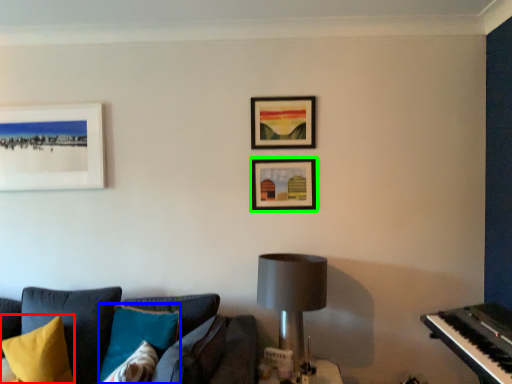
Question: Considering the real-world distances, which object is farthest from pillow (highlighted by a red box)? pillow (highlighted by a blue box) or picture frame (highlighted by a green box)?

Choices:
 (A) pillow
 (B) picture frame

Answer: (B)